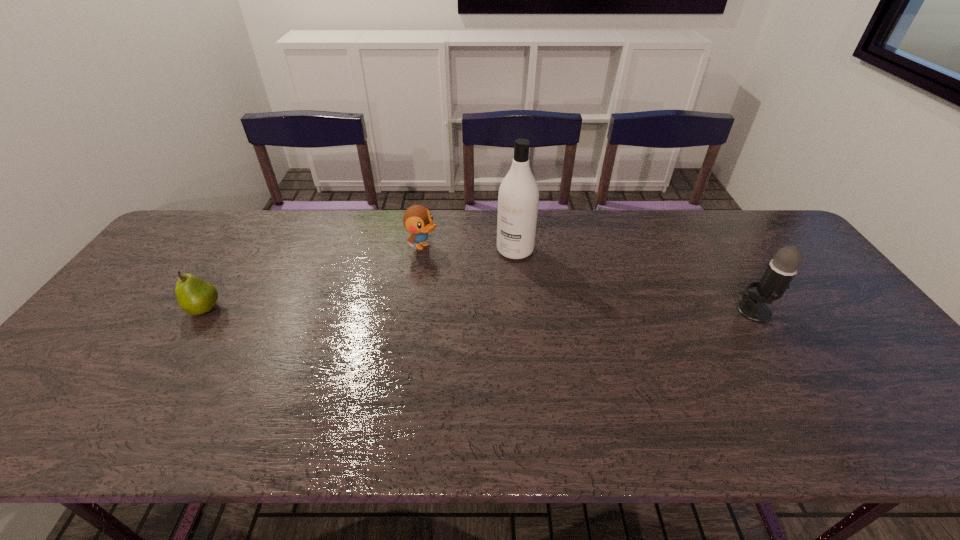
Where is `free spot between the duck and the pear`? This screenshot has height=540, width=960. free spot between the duck and the pear is located at coordinates (314, 278).

Image resolution: width=960 pixels, height=540 pixels. I want to click on object that is the closest to the duck, so click(518, 198).

Choose which object is the third nearest neighbor to the microphone. Please provide its 2D coordinates. Your answer should be formatted as a tuple, i.e. [(x, y)], where the tuple contains the x and y coordinates of a point satisfying the conditions above.

[(195, 296)]

This screenshot has height=540, width=960. In order to click on free location that satisfies the following two spatial constraints: 1. on the front side of the second object from left to right; 2. on the right side of the second object from right to left in this screenshot , I will do `click(422, 250)`.

At what (x,y) coordinates should I click in order to perform the action: click on free space in the image that satisfies the following two spatial constraints: 1. on the back side of the pear; 2. on the right side of the duck. Please return your answer as a coordinate pair (x, y). Looking at the image, I should click on coord(245,246).

Identify the location of free spot that satisfies the following two spatial constraints: 1. on the front side of the duck; 2. on the right side of the rightmost object. (413, 312).

You are a GUI agent. You are given a task and a screenshot of the screen. Output one action in this format:
    pyautogui.click(x=<x>, y=<y>)
    Task: Click on the free space that satisfies the following two spatial constraints: 1. on the front side of the tallest object; 2. on the left side of the third shortest object
    The width and height of the screenshot is (960, 540).
    Given the screenshot: What is the action you would take?
    pyautogui.click(x=521, y=312)

The width and height of the screenshot is (960, 540). I want to click on vacant space that satisfies the following two spatial constraints: 1. on the front side of the rightmost object; 2. on the right side of the leftmost object, so click(x=203, y=312).